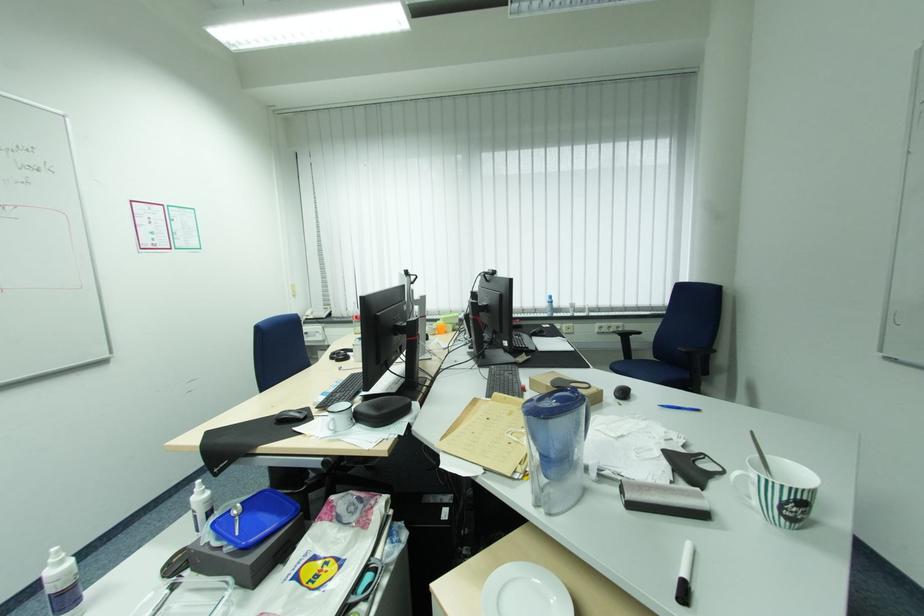
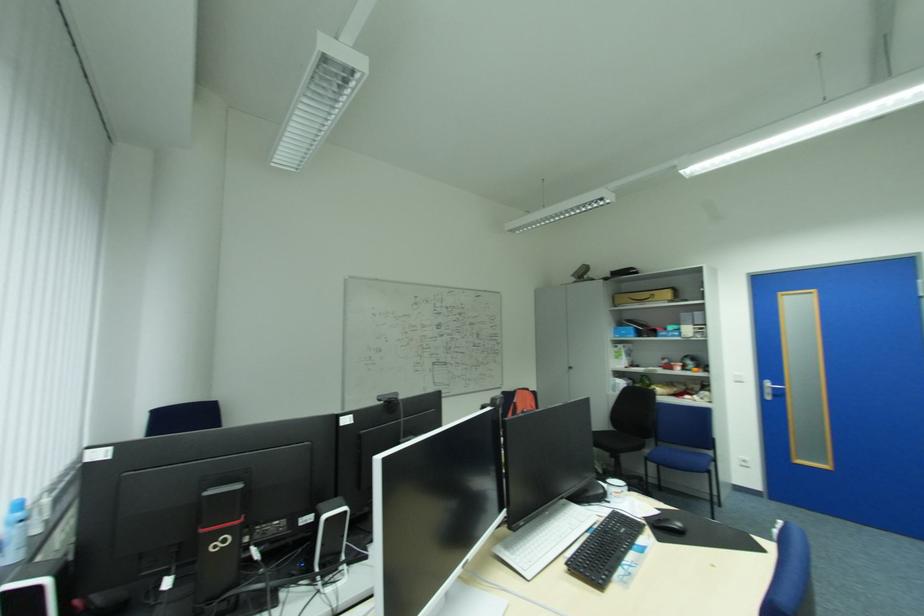
Question: I am providing you with two images of the same scene from different viewpoints. Please identify which objects are invisible in image2.

Choices:
 (A) white ceramic plate
 (B) small ironing board
 (C) cardboard box
 (D) black computer mouse

Answer: (A)